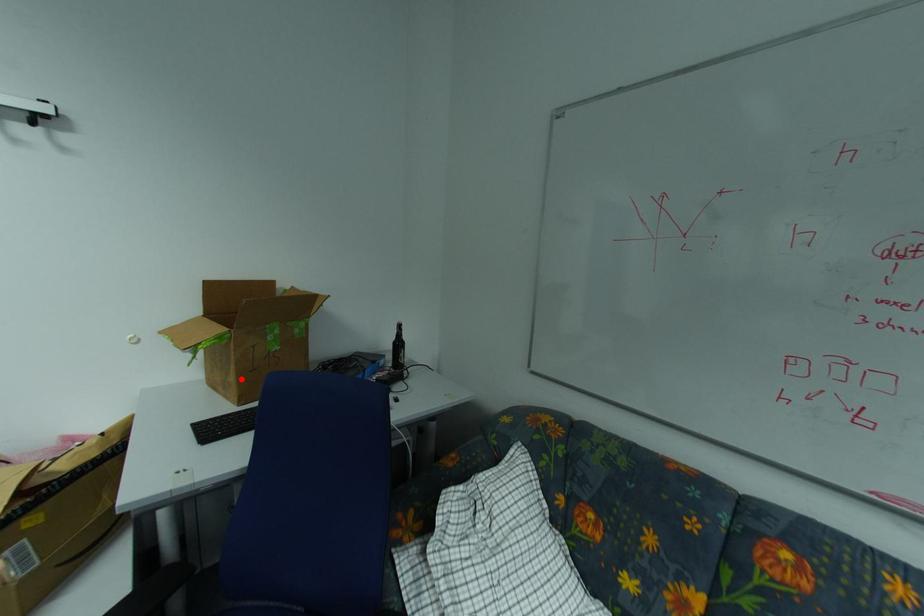
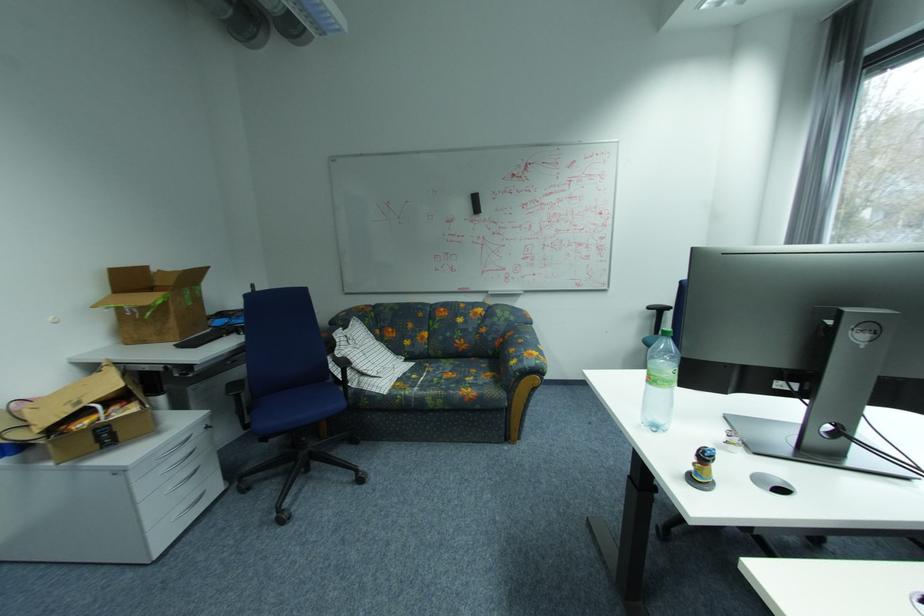
Question: A red point is marked in image1. In image2, is the corresponding 3D point closer to the camera or farther? Reply with the corresponding letter.

Choices:
 (A) The corresponding 3D point is closer.
 (B) The corresponding 3D point is farther.

Answer: (A)